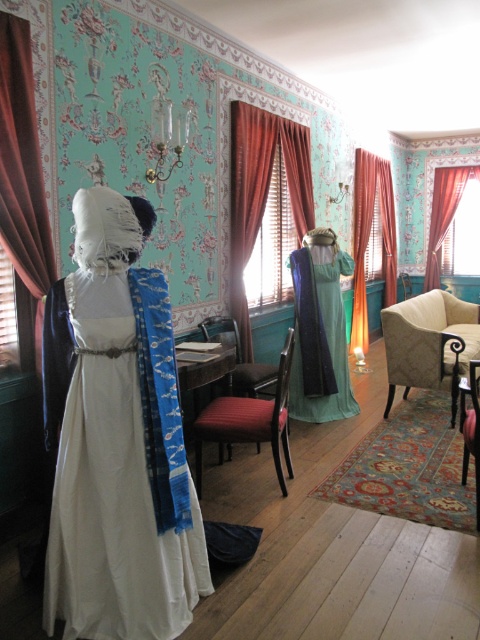
In the scene shown: You are a guest in this room and want to sit down. You see the velvet burgundy curtain at center and the beige fabric armchair at lower right. Which object can you sit on?

The beige fabric armchair at lower right can be sat on, while the velvet burgundy curtain at center is a curtain and not meant for sitting. Additionally, the beige fabric armchair at lower right is larger than the velvet burgundy curtain at center, making it more suitable for seating.

In the scene shown: You are a tailor in this room and need to decide which item, the teal fabric dress at center or the velvet burgundy chair at center, requires more space to store. Based on their sizes, which one would take up more storage space?

The velvet burgundy chair at center takes up more storage space because it is larger than the teal fabric dress at center.